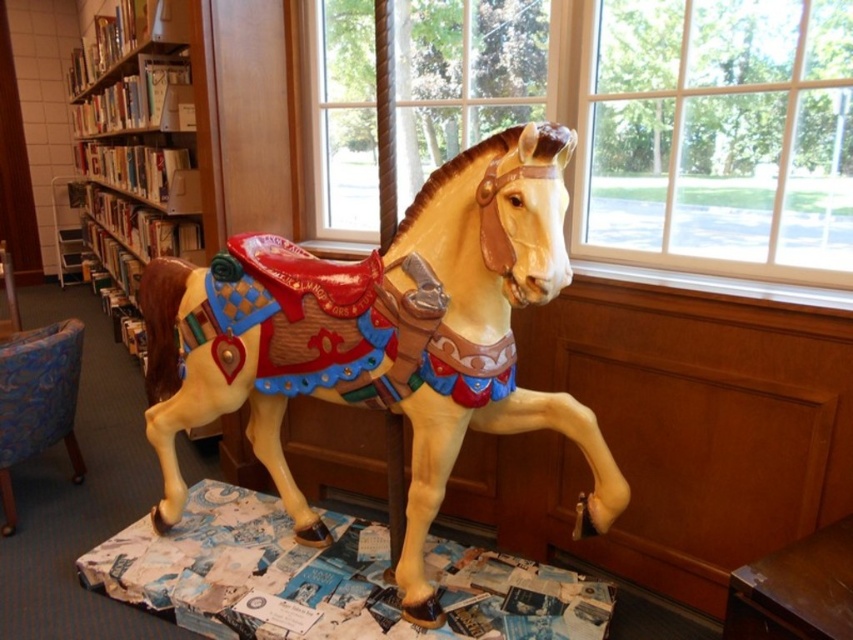
Measure the distance between painted wood horse at center and camera.

painted wood horse at center is 1.55 meters away from camera.

Who is more distant from viewer, (x=299, y=388) or (x=144, y=45)?

Positioned behind is point (x=144, y=45).

Does point (409, 310) lie in front of point (190, 8)?

Yes.

Where is `painted wood horse at center`? The height and width of the screenshot is (640, 853). painted wood horse at center is located at coordinates (380, 337).

Is point (120, 186) farther from camera compared to point (62, 436)?

Yes, point (120, 186) is farther from viewer.

Find the location of a particular element. This screenshot has width=853, height=640. wooden bookcase at left is located at coordinates (138, 136).

Is point (645, 13) closer to viewer compared to point (12, 337)?

That is True.

Can you confirm if clear glass window at center is positioned below blue fabric chair at lower left?

No.

The height and width of the screenshot is (640, 853). I want to click on clear glass window at center, so click(x=666, y=132).